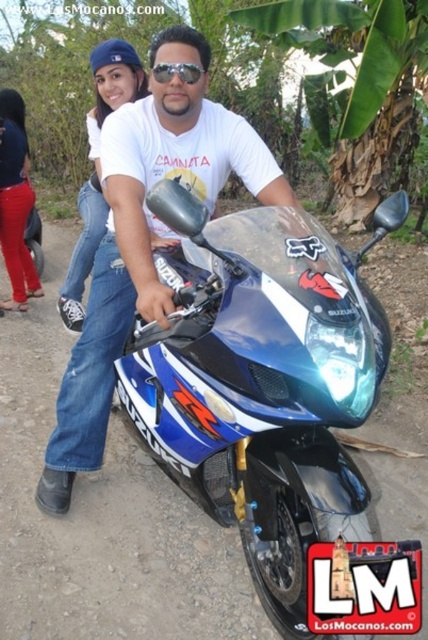
Does blue glossy sportbike at center have a smaller size compared to matte white t-shirt at center?

Yes.

Between blue glossy sportbike at center and matte white t-shirt at center, which one has less height?

blue glossy sportbike at center is shorter.

Who is more forward, [335,385] or [62,461]?

Point [335,385] is more forward.

I want to click on blue glossy sportbike at center, so click(261, 380).

Locate an element on the screen. The width and height of the screenshot is (428, 640). matte white t-shirt at center is located at coordinates (145, 237).

Between point (142, 109) and point (11, 93), which one is positioned in front?

Positioned in front is point (142, 109).

Is point (168, 96) farther from viewer compared to point (17, 140)?

No, (168, 96) is closer to viewer.

This screenshot has width=428, height=640. What are the coordinates of `matte white t-shirt at center` in the screenshot? It's located at (145, 237).

Is blue glossy sportbike at center shorter than matte white t-shirt at upper center?

Yes, blue glossy sportbike at center is shorter than matte white t-shirt at upper center.

Who is higher up, blue glossy sportbike at center or matte white t-shirt at upper center?

Positioned higher is matte white t-shirt at upper center.

Where is `blue glossy sportbike at center`? Image resolution: width=428 pixels, height=640 pixels. blue glossy sportbike at center is located at coordinates (261, 380).